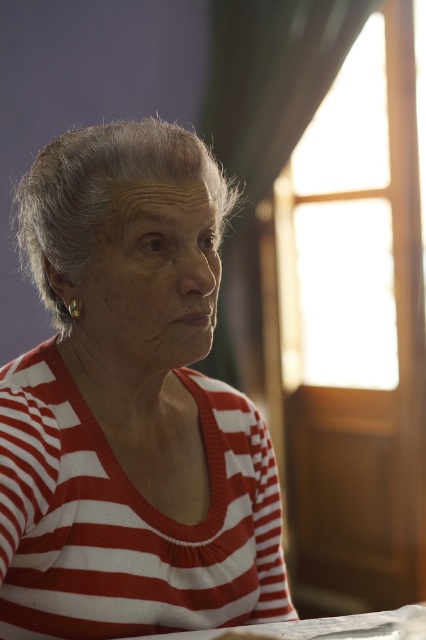
You are a photographer adjusting the camera focus. The subject is wearing a red striped sweater at center and has a white paper at lower center. To ensure both are in focus, what is the minimum distance the camera should be set to cover both objects?

The red striped sweater at center and white paper at lower center are 25.90 centimeters apart from each other. To ensure both are in focus, the camera should be set to a depth of field that covers at least 25.90 centimeters.

You are an interior designer assessing the placement of items in this room. You notice the red striped sweater at center and the white paper at lower center. Which object occupies a larger area in the image?

The red striped sweater at center is bigger than the white paper at lower center, so it occupies a larger area in the image.

You are a photographer adjusting the focus of your camera. You notice a point at coordinates [131,404] in the image. Based on the scene description, what object is located at that point?

The point at coordinates [131,404] corresponds to the red striped sweater at center.